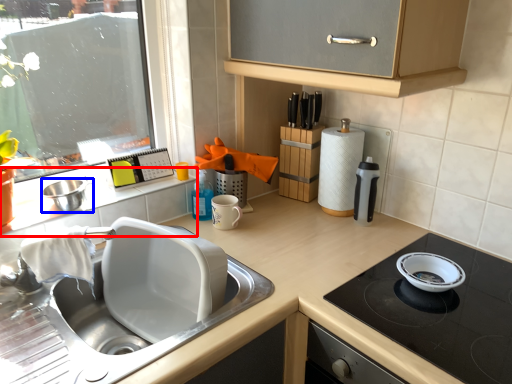
Question: Which object is closer to the camera taking this photo, window sill (highlighted by a red box) or mixing bowl (highlighted by a blue box)?

Choices:
 (A) window sill
 (B) mixing bowl

Answer: (A)